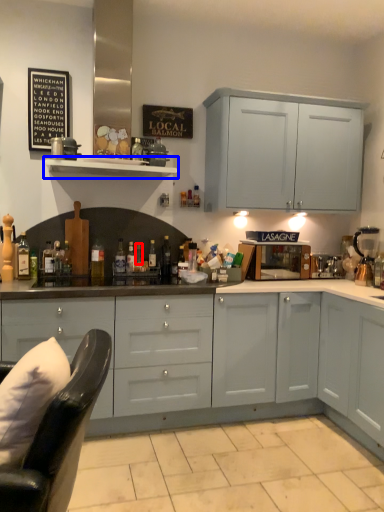
Question: Which of the following is the closest to the observer, bottle (highlighted by a red box) or shelf (highlighted by a blue box)?

Choices:
 (A) bottle
 (B) shelf

Answer: (B)